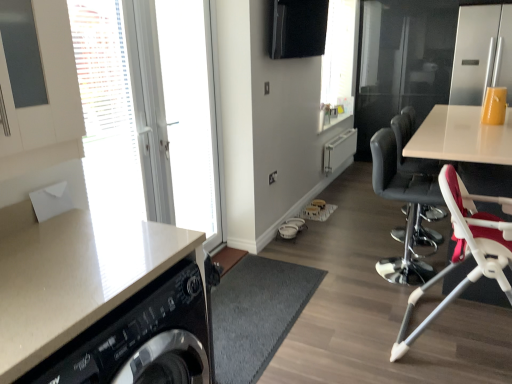
Where is `blank area beneath red fabric high chair at right, arranged as the first chair when viewed from the front (from a real-world perspective)`? blank area beneath red fabric high chair at right, arranged as the first chair when viewed from the front (from a real-world perspective) is located at coordinates (466, 342).